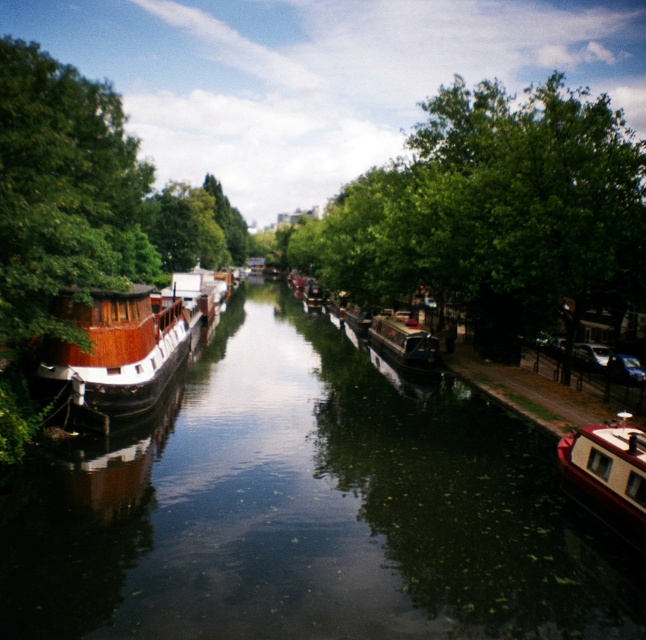
Question: Considering the relative positions of wooden cabin cruiser at left and wooden polished boat at center in the image provided, where is wooden cabin cruiser at left located with respect to wooden polished boat at center?

Choices:
 (A) above
 (B) below

Answer: (A)

Question: Which of the following is the closest to the observer?

Choices:
 (A) wooden cabin cruiser at left
 (B) wooden polished boat at center
 (C) shiny red boat at lower right

Answer: (C)

Question: Can you confirm if shiny red boat at lower right is bigger than wooden polished boat at center?

Choices:
 (A) yes
 (B) no

Answer: (B)

Question: Which point is farther from the camera taking this photo?

Choices:
 (A) (625, 448)
 (B) (152, 396)

Answer: (B)

Question: In this image, where is green leafy tree at center located relative to wooden polished boat at center?

Choices:
 (A) above
 (B) below

Answer: (A)

Question: Which is nearer to the green leafy tree at center?

Choices:
 (A) wooden canal boat at left
 (B) wooden cabin cruiser at left
 (C) shiny red boat at lower right

Answer: (A)